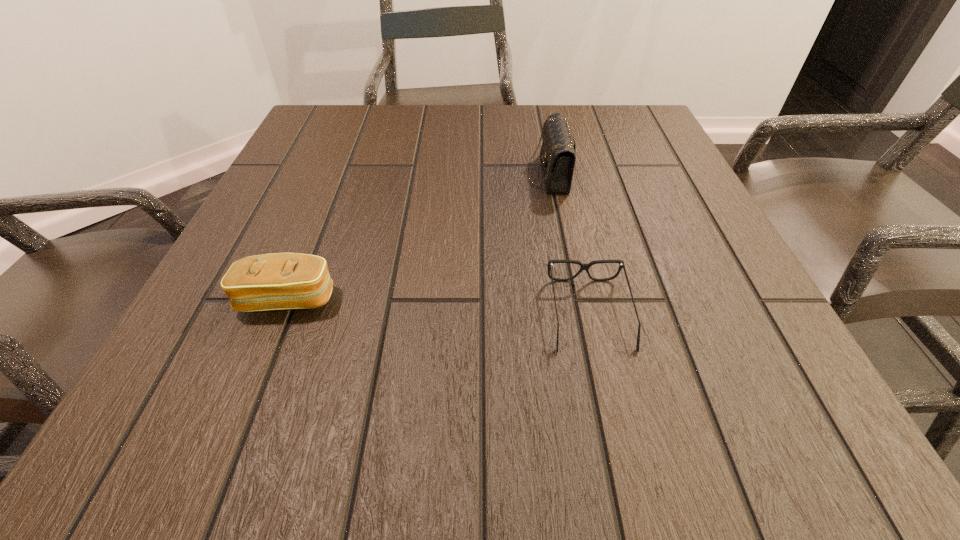
At what (x,y) coordinates should I click in order to perform the action: click on free point that satisfies the following two spatial constraints: 1. on the front flap of the tallest object; 2. on the zipper side of the leftmost object. Please return your answer as a coordinate pair (x, y). Looking at the image, I should click on tap(573, 299).

The width and height of the screenshot is (960, 540). I want to click on vacant region that satisfies the following two spatial constraints: 1. on the front flap of the right clutch bag; 2. on the zipper side of the second tallest object, so click(x=573, y=299).

Identify the location of free region that satisfies the following two spatial constraints: 1. on the front flap of the right clutch bag; 2. on the zipper side of the leftmost object. [x=573, y=299].

Locate an element on the screen. The height and width of the screenshot is (540, 960). vacant space that satisfies the following two spatial constraints: 1. on the front flap of the farther clutch bag; 2. on the zipper side of the nearer clutch bag is located at coordinates (573, 299).

Where is `vacant area in the image that satisfies the following two spatial constraints: 1. on the front flap of the right clutch bag; 2. on the zipper side of the nearer clutch bag`? The image size is (960, 540). vacant area in the image that satisfies the following two spatial constraints: 1. on the front flap of the right clutch bag; 2. on the zipper side of the nearer clutch bag is located at coordinates (573, 299).

Locate an element on the screen. The height and width of the screenshot is (540, 960). free space that satisfies the following two spatial constraints: 1. on the front flap of the tallest object; 2. on the zipper side of the leftmost object is located at coordinates (573, 299).